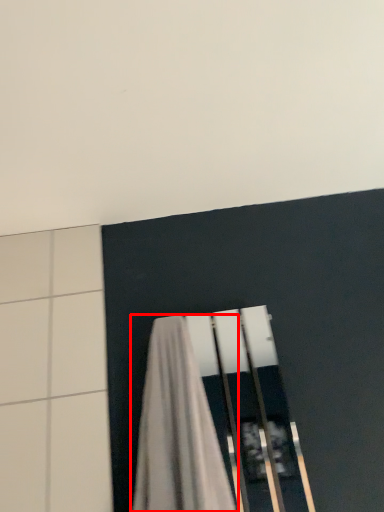
Question: From the image's perspective, what is the correct spatial relationship of curtain (annotated by the red box) in relation to backdrop?

Choices:
 (A) below
 (B) above

Answer: (A)